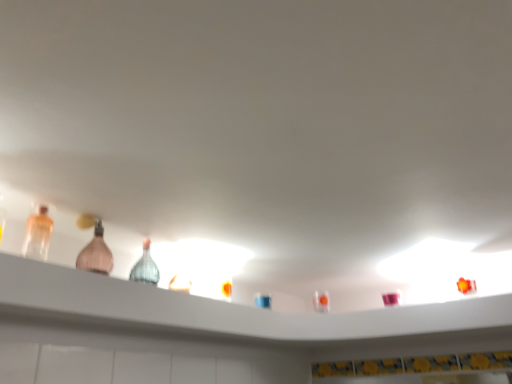
Describe the element at coordinates (37, 235) in the screenshot. I see `translucent plastic bottle at left, which is counted as the second bottle, starting from the back` at that location.

The image size is (512, 384). In order to click on pink glass bottle at left, acting as the first bottle starting from the back in this screenshot , I will do [x=96, y=254].

From the image's perspective, which bottle is the 2nd one above the translucent glass bottles at upper center? Please provide its 2D coordinates.

[(37, 235)]

Is point (347, 323) more distant than point (42, 251)?

Yes, point (347, 323) is behind point (42, 251).

Is translucent glass bottles at upper center far from translucent plastic bottle at left, the 2th bottle in the right-to-left sequence?

translucent glass bottles at upper center is actually quite close to translucent plastic bottle at left, the 2th bottle in the right-to-left sequence.

Which of these two, translucent glass bottles at upper center or translucent plastic bottle at left, the first bottle in the front-to-back sequence, stands taller?

With more height is translucent plastic bottle at left, the first bottle in the front-to-back sequence.

Is translucent plastic bottle at left, the first bottle in the front-to-back sequence, closer to the viewer compared to translucent glass bottles at upper center?

That is False.

Who is shorter, translucent plastic bottle at left, the 2th bottle in the right-to-left sequence, or translucent glass bottles at upper center?

translucent glass bottles at upper center is shorter.

Is translucent plastic bottle at left, the 1th bottle when ordered from left to right, positioned with its back to translucent glass bottles at upper center?

No, translucent plastic bottle at left, the 1th bottle when ordered from left to right, is not facing away from translucent glass bottles at upper center.

Looking at their sizes, would you say translucent plastic bottle at left, the 1th bottle when ordered from left to right, is wider or thinner than pink glass bottle at left, acting as the first bottle starting from the back?

Clearly, translucent plastic bottle at left, the 1th bottle when ordered from left to right, has less width compared to pink glass bottle at left, acting as the first bottle starting from the back.

Is pink glass bottle at left, the 2th bottle when ordered from left to right, at the back of translucent plastic bottle at left, which is counted as the second bottle, starting from the back?

translucent plastic bottle at left, which is counted as the second bottle, starting from the back, is not turned away from pink glass bottle at left, the 2th bottle when ordered from left to right.

In terms of size, does translucent plastic bottle at left, the 2th bottle in the right-to-left sequence, appear bigger or smaller than pink glass bottle at left, which ranks as the first bottle in right-to-left order?

Clearly, translucent plastic bottle at left, the 2th bottle in the right-to-left sequence, is smaller in size than pink glass bottle at left, which ranks as the first bottle in right-to-left order.

From a real-world perspective, is translucent plastic bottle at left, the 1th bottle when ordered from left to right, under pink glass bottle at left, which is the second bottle from front to back?

Yes, from a real-world perspective, translucent plastic bottle at left, the 1th bottle when ordered from left to right, is under pink glass bottle at left, which is the second bottle from front to back.

Is pink glass bottle at left, which ranks as the first bottle in right-to-left order, located outside translucent plastic bottle at left, which is counted as the second bottle, starting from the back?

That's correct, pink glass bottle at left, which ranks as the first bottle in right-to-left order, is outside of translucent plastic bottle at left, which is counted as the second bottle, starting from the back.

Are pink glass bottle at left, the 2th bottle when ordered from left to right, and translucent plastic bottle at left, the 1th bottle when ordered from left to right, far apart?

No, there isn't a large distance between pink glass bottle at left, the 2th bottle when ordered from left to right, and translucent plastic bottle at left, the 1th bottle when ordered from left to right.

Is point (77, 262) in front of point (44, 215)?

That is False.

In order to click on bottle below the translucent plastic bottle at left, the first bottle in the front-to-back sequence (from the image's perspective) in this screenshot , I will do `click(96, 254)`.

Are translucent glass bottles at upper center and pink glass bottle at left, which is the second bottle from front to back, beside each other?

translucent glass bottles at upper center and pink glass bottle at left, which is the second bottle from front to back, are clearly separated.

Considering the positions of point (487, 308) and point (98, 237), is point (487, 308) closer or farther from the camera than point (98, 237)?

Point (487, 308) appears to be farther away from the viewer than point (98, 237).

How much distance is there between translucent glass bottles at upper center and pink glass bottle at left, which ranks as the first bottle in right-to-left order?

A distance of 16.51 inches exists between translucent glass bottles at upper center and pink glass bottle at left, which ranks as the first bottle in right-to-left order.

Considering the relative positions of translucent glass bottles at upper center and pink glass bottle at left, acting as the first bottle starting from the back, in the image provided, is translucent glass bottles at upper center in front of pink glass bottle at left, acting as the first bottle starting from the back,?

That is True.

Is pink glass bottle at left, which is the second bottle from front to back, oriented away from translucent glass bottles at upper center?

No, translucent glass bottles at upper center is not at the back of pink glass bottle at left, which is the second bottle from front to back.

In terms of height, does pink glass bottle at left, which is the second bottle from front to back, look taller or shorter compared to translucent glass bottles at upper center?

Clearly, pink glass bottle at left, which is the second bottle from front to back, is taller compared to translucent glass bottles at upper center.

From a real-world perspective, is pink glass bottle at left, which is the second bottle from front to back, on translucent glass bottles at upper center?

Yes, from a real-world perspective, pink glass bottle at left, which is the second bottle from front to back, is over translucent glass bottles at upper center

From the image's perspective, is pink glass bottle at left, the 2th bottle when ordered from left to right, under translucent glass bottles at upper center?

Incorrect, from the image's perspective, pink glass bottle at left, the 2th bottle when ordered from left to right, is higher than translucent glass bottles at upper center.

The height and width of the screenshot is (384, 512). What are the coordinates of `shelf lying on the right of translucent plastic bottle at left, the 1th bottle when ordered from left to right` in the screenshot? It's located at (222, 308).

Image resolution: width=512 pixels, height=384 pixels. Find the location of `the 2nd bottle above the translucent glass bottles at upper center (from the image's perspective)`. the 2nd bottle above the translucent glass bottles at upper center (from the image's perspective) is located at coordinates (37, 235).

When comparing their distances from translucent plastic bottle at left, the first bottle in the front-to-back sequence, does pink glass bottle at left, which is the second bottle from front to back, or translucent glass bottles at upper center seem closer?

Based on the image, pink glass bottle at left, which is the second bottle from front to back, appears to be nearer to translucent plastic bottle at left, the first bottle in the front-to-back sequence.

Which object lies further to the anchor point translucent glass bottles at upper center, pink glass bottle at left, which ranks as the first bottle in right-to-left order, or translucent plastic bottle at left, the first bottle in the front-to-back sequence?

translucent plastic bottle at left, the first bottle in the front-to-back sequence, is further to translucent glass bottles at upper center.

Considering their positions, is translucent plastic bottle at left, the 1th bottle when ordered from left to right, positioned further to translucent glass bottles at upper center than pink glass bottle at left, the 2th bottle when ordered from left to right?

translucent plastic bottle at left, the 1th bottle when ordered from left to right, is positioned further to the anchor translucent glass bottles at upper center.

Based on their spatial positions, is translucent glass bottles at upper center or pink glass bottle at left, the 2th bottle when ordered from left to right, further from translucent plastic bottle at left, the first bottle in the front-to-back sequence?

translucent glass bottles at upper center is positioned further to the anchor translucent plastic bottle at left, the first bottle in the front-to-back sequence.

Based on their spatial positions, is translucent plastic bottle at left, the 2th bottle in the right-to-left sequence, or translucent glass bottles at upper center closer to pink glass bottle at left, acting as the first bottle starting from the back?

translucent plastic bottle at left, the 2th bottle in the right-to-left sequence, lies closer to pink glass bottle at left, acting as the first bottle starting from the back, than the other object.

Considering their positions, is translucent glass bottles at upper center positioned further to pink glass bottle at left, acting as the first bottle starting from the back, than translucent plastic bottle at left, which is counted as the second bottle, starting from the back?

translucent glass bottles at upper center lies further to pink glass bottle at left, acting as the first bottle starting from the back, than the other object.

Locate an element on the screen. The image size is (512, 384). bottle located between translucent plastic bottle at left, the first bottle in the front-to-back sequence, and translucent glass bottles at upper center in the left-right direction is located at coordinates (96, 254).